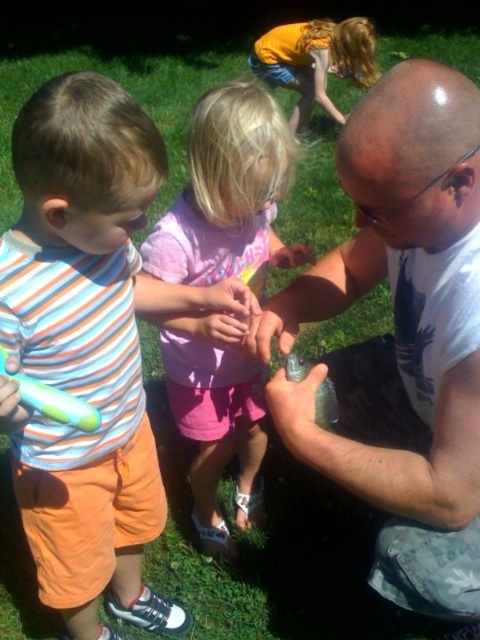
Based on the scene description, which object is narrower between the satin white shirt at center and the striped cotton shirt at center?

The satin white shirt at center is narrower than the striped cotton shirt at center.

You are a photographer trying to capture a clear photo of the striped cotton shirt at center. However, the satin white shirt at center is blocking your view. Can you move around to the left side to get an unobstructed view?

The striped cotton shirt at center is behind the satin white shirt at center, so moving to the left side might not help because the satin white shirt is still in front. You might need to move around to the right side instead.

Based on the scene description, which object is positioned higher between the satin white shirt at center and the striped cotton shirt at center?

The satin white shirt at center is positioned higher than the striped cotton shirt at center.